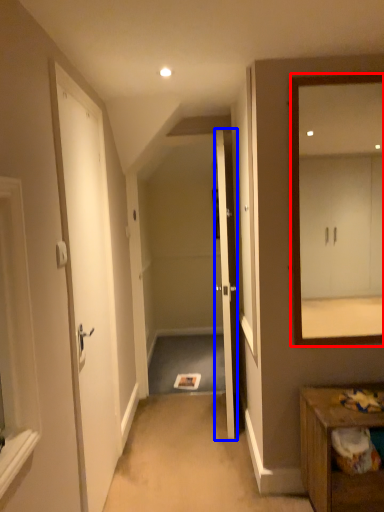
Question: Which of the following is the closest to the observer, mirror (highlighted by a red box) or door (highlighted by a blue box)?

Choices:
 (A) mirror
 (B) door

Answer: (A)